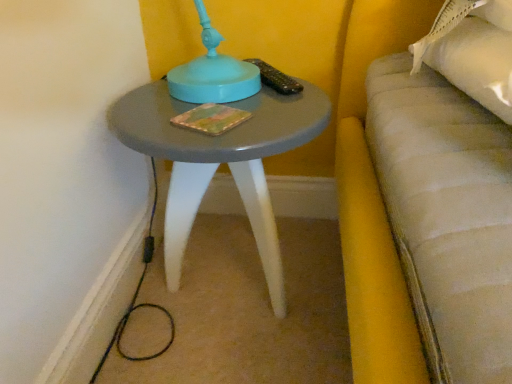
I want to click on empty space that is to the right of multicolored textured book at center, so click(280, 110).